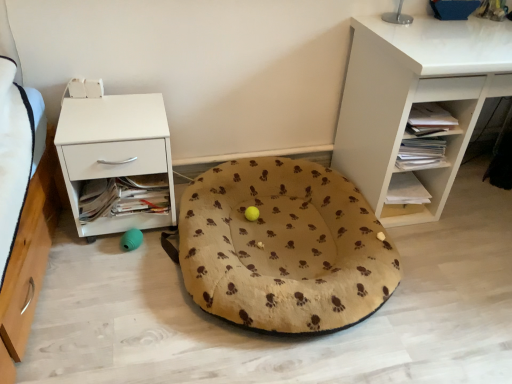
Question: Can you confirm if beige fabric dog bed at center is positioned to the right of white matte shelf at center right, marked as the 1th shelf in a bottom-to-top arrangement?

Choices:
 (A) no
 (B) yes

Answer: (A)

Question: Is beige fabric dog bed at center outside white matte shelf at center right, the 2th shelf viewed from the top?

Choices:
 (A) no
 (B) yes

Answer: (B)

Question: From the image's perspective, is beige fabric dog bed at center beneath white matte shelf at center right, marked as the 1th shelf in a bottom-to-top arrangement?

Choices:
 (A) no
 (B) yes

Answer: (B)

Question: Does beige fabric dog bed at center have a greater width compared to white matte shelf at center right, the 2th shelf viewed from the top?

Choices:
 (A) no
 (B) yes

Answer: (B)

Question: Would you say white matte shelf at center right, the 2th shelf viewed from the top, is part of beige fabric dog bed at center's contents?

Choices:
 (A) no
 (B) yes

Answer: (A)

Question: Is beige fabric dog bed at center shorter than white matte shelf at center right, the 2th shelf viewed from the top?

Choices:
 (A) no
 (B) yes

Answer: (A)

Question: From the image's perspective, is white matte desk at upper right, arranged as the 1th shelf when viewed from the top, under white matte nightstand at left?

Choices:
 (A) no
 (B) yes

Answer: (A)

Question: Can you confirm if white matte desk at upper right, arranged as the 1th shelf when viewed from the top, is positioned to the right of white matte nightstand at left?

Choices:
 (A) no
 (B) yes

Answer: (B)

Question: Is white matte desk at upper right, arranged as the 1th shelf when viewed from the top, outside white matte nightstand at left?

Choices:
 (A) no
 (B) yes

Answer: (B)

Question: Is white matte desk at upper right, the 2th shelf when ordered from bottom to top, turned away from white matte nightstand at left?

Choices:
 (A) no
 (B) yes

Answer: (A)

Question: Considering the relative sizes of white matte desk at upper right, arranged as the 1th shelf when viewed from the top, and white matte nightstand at left in the image provided, is white matte desk at upper right, arranged as the 1th shelf when viewed from the top, wider than white matte nightstand at left?

Choices:
 (A) no
 (B) yes

Answer: (B)

Question: Is white matte desk at upper right, the 2th shelf when ordered from bottom to top, not near white matte nightstand at left?

Choices:
 (A) yes
 (B) no

Answer: (A)

Question: Does white matte desk at upper right, arranged as the 1th shelf when viewed from the top, have a lesser width compared to beige fabric dog bed at center?

Choices:
 (A) no
 (B) yes

Answer: (B)